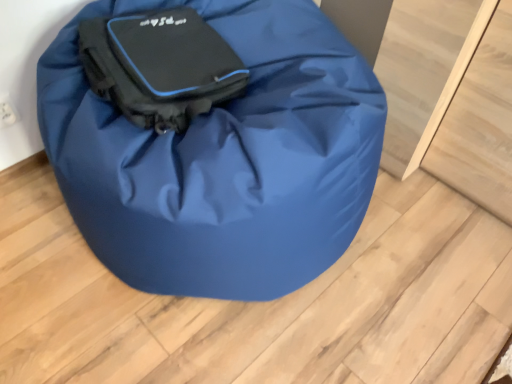
Question: Considering the positions of point (x=202, y=258) and point (x=208, y=31), is point (x=202, y=258) closer or farther from the camera than point (x=208, y=31)?

Choices:
 (A) farther
 (B) closer

Answer: (B)

Question: From a real-world perspective, is matte black bag at center, which is the first luggage and bags from front to back, physically located above or below matte black bag at center, acting as the first luggage and bags starting from the back?

Choices:
 (A) below
 (B) above

Answer: (A)

Question: In the image, is matte black bag at center, which is the first luggage and bags from front to back, positioned in front of or behind matte black bag at center, acting as the first luggage and bags starting from the back?

Choices:
 (A) behind
 (B) front

Answer: (B)

Question: Considering the positions of matte black bag at center, acting as the 2th luggage and bags starting from the front, and matte black bag at center, acting as the 2th luggage and bags starting from the back, in the image, is matte black bag at center, acting as the 2th luggage and bags starting from the front, wider or thinner than matte black bag at center, acting as the 2th luggage and bags starting from the back,?

Choices:
 (A) thin
 (B) wide

Answer: (A)

Question: Considering the relative positions of matte black bag at center, acting as the first luggage and bags starting from the back, and matte black bag at center, acting as the 2th luggage and bags starting from the back, in the image provided, is matte black bag at center, acting as the first luggage and bags starting from the back, to the left or to the right of matte black bag at center, acting as the 2th luggage and bags starting from the back,?

Choices:
 (A) left
 (B) right

Answer: (A)

Question: Does point (141, 26) appear closer or farther from the camera than point (240, 228)?

Choices:
 (A) closer
 (B) farther

Answer: (B)

Question: Is matte black bag at center, acting as the first luggage and bags starting from the back, in front of or behind matte black bag at center, acting as the 2th luggage and bags starting from the back, in the image?

Choices:
 (A) behind
 (B) front

Answer: (A)